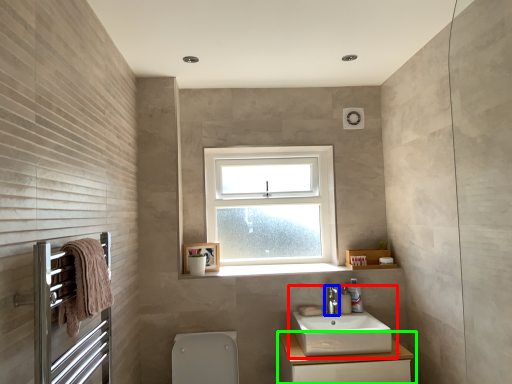
Question: Which is farther away from sink (highlighted by a red box)? tap (highlighted by a blue box) or bathroom cabinet (highlighted by a green box)?

Choices:
 (A) tap
 (B) bathroom cabinet

Answer: (A)